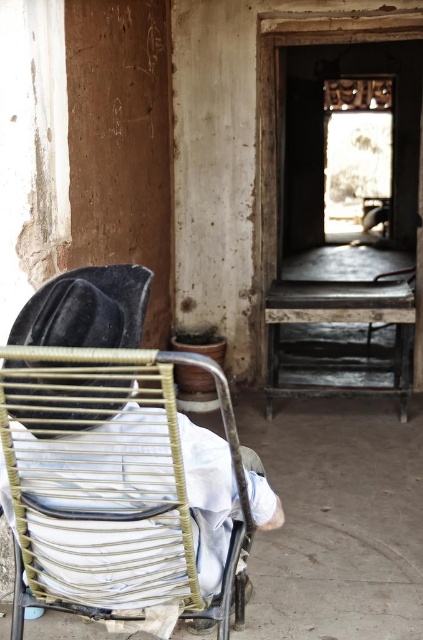
You are an interior designer planning to place a new rug in this room. The rug must fit between the woven wood rocking chair at center and the velvet black hat at upper left. Given their sizes, which object will require more space on the rug?

The woven wood rocking chair at center requires more space on the rug because it is larger in size than the velvet black hat at upper left.

You are a painter setting up your easel in this dimly lit rustic building. You have a velvet black hat at upper left and a woven wood rocking chair at center. Which object should you place your easel in front of to ensure it doesn

The woven wood rocking chair at center is much taller than the velvet black hat at upper left. To ensure your easel is placed in front of an object that provides sufficient height for your painting setup, you should position it in front of the woven wood rocking chair at center.